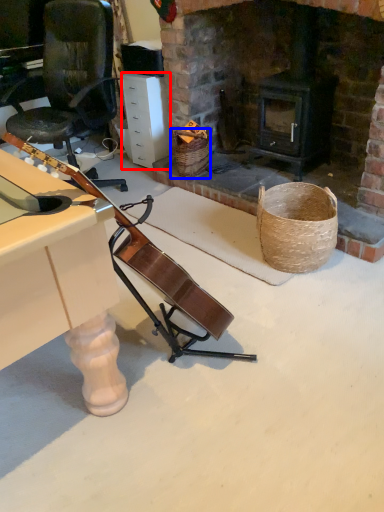
Question: Which object is further to the camera taking this photo, drawer (highlighted by a red box) or basket (highlighted by a blue box)?

Choices:
 (A) drawer
 (B) basket

Answer: (A)